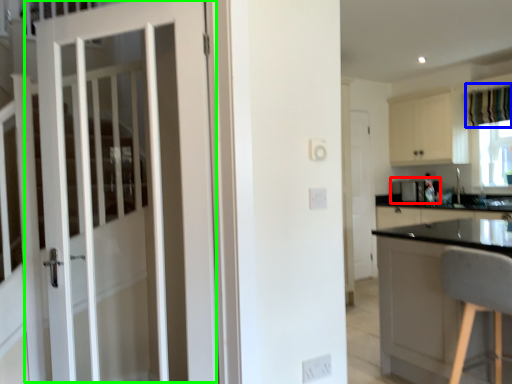
Question: Based on their relative distances, which object is nearer to appliance (highlighted by a red box)? Choose from curtain (highlighted by a blue box) and door (highlighted by a green box).

Choices:
 (A) curtain
 (B) door

Answer: (A)